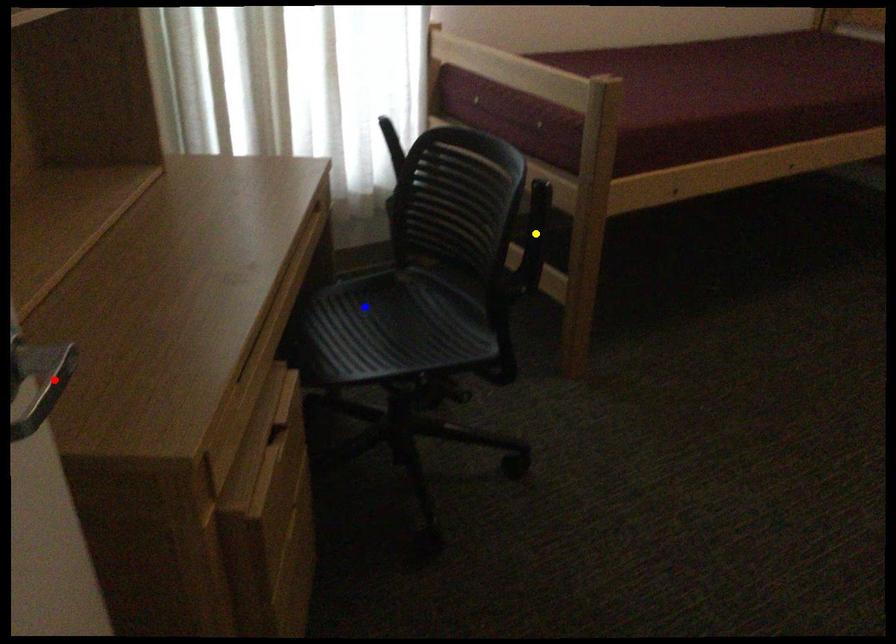
Consider the image. Order these from nearest to farthest:
- blue point
- red point
- yellow point

yellow point < blue point < red point